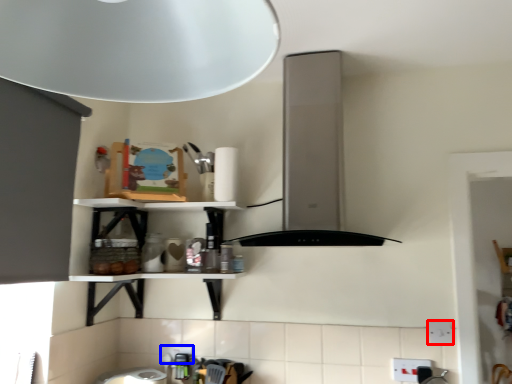
Question: Which point is closer to the camera, electric outlet (highlighted by a red box) or electric outlet (highlighted by a blue box)?

Choices:
 (A) electric outlet
 (B) electric outlet

Answer: (A)